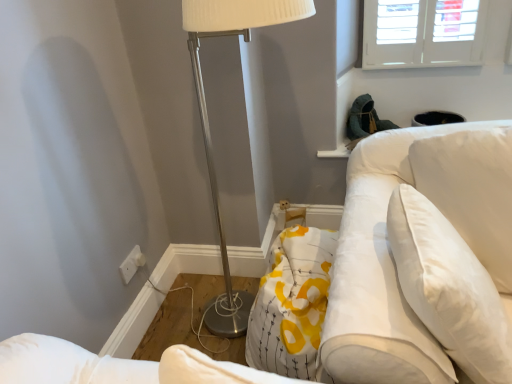
The width and height of the screenshot is (512, 384). Describe the element at coordinates (391, 254) in the screenshot. I see `white fabric swivel chair at right` at that location.

Describe the element at coordinates (132, 264) in the screenshot. I see `white plastic electric outlet at lower left` at that location.

What do you see at coordinates (208, 119) in the screenshot? The image size is (512, 384). I see `metallic silver floor lamp at center` at bounding box center [208, 119].

This screenshot has width=512, height=384. Describe the element at coordinates (449, 287) in the screenshot. I see `white soft pillow at upper right` at that location.

Measure the distance between white soft pillow at upper right and camera.

white soft pillow at upper right and camera are 33.03 inches apart from each other.

Locate an element on the screen. The height and width of the screenshot is (384, 512). white fabric swivel chair at right is located at coordinates (391, 254).

Which object is more forward, white fabric swivel chair at right or white soft pillow at upper right?

Positioned in front is white soft pillow at upper right.

Identify the location of swivel chair lying above the white soft pillow at upper right (from the image's perspective). (391, 254).

Can you tell me how much white fabric swivel chair at right and white soft pillow at upper right differ in facing direction?

There is a 25.9-degree angle between the facing directions of white fabric swivel chair at right and white soft pillow at upper right.

Considering the points (129, 277) and (223, 4), which point is in front, point (129, 277) or point (223, 4)?

The point (223, 4) is closer.

Considering the sizes of objects white plastic electric outlet at lower left and metallic silver floor lamp at center in the image provided, who is shorter, white plastic electric outlet at lower left or metallic silver floor lamp at center?

With less height is white plastic electric outlet at lower left.

Based on their positions, is white plastic electric outlet at lower left located to the left or right of metallic silver floor lamp at center?

Clearly, white plastic electric outlet at lower left is on the left of metallic silver floor lamp at center in the image.

From the image's perspective, would you say white plastic electric outlet at lower left is shown under metallic silver floor lamp at center?

Yes, from the image's perspective, white plastic electric outlet at lower left is below metallic silver floor lamp at center.

Can you confirm if white plastic electric outlet at lower left is shorter than white soft pillow at upper right?

Yes.

From a real-world perspective, is white plastic electric outlet at lower left under white soft pillow at upper right?

Yes.

Is point (129, 261) more distant than point (458, 278)?

Yes, point (129, 261) is farther from viewer.

Does white plastic electric outlet at lower left have a smaller size compared to white soft pillow at upper right?

Correct, white plastic electric outlet at lower left occupies less space than white soft pillow at upper right.

Does white plastic electric outlet at lower left have a lesser height compared to white fabric swivel chair at right?

Yes, white plastic electric outlet at lower left is shorter than white fabric swivel chair at right.

Is white plastic electric outlet at lower left far from white fabric swivel chair at right?

Yes.

Which is less distant, [130,263] or [400,351]?

The point [400,351] is in front.

Could you measure the distance between white plastic electric outlet at lower left and white fabric swivel chair at right?

white plastic electric outlet at lower left and white fabric swivel chair at right are 1.04 meters apart from each other.

Is white soft pillow at upper right positioned with its back to white plastic electric outlet at lower left?

No.

Is white soft pillow at upper right smaller than white plastic electric outlet at lower left?

No.

Considering the relative positions of white soft pillow at upper right and white plastic electric outlet at lower left in the image provided, is white soft pillow at upper right to the left of white plastic electric outlet at lower left from the viewer's perspective?

Incorrect, white soft pillow at upper right is not on the left side of white plastic electric outlet at lower left.

Which object is more forward, white soft pillow at upper right or white plastic electric outlet at lower left?

white soft pillow at upper right.

Are white soft pillow at upper right and metallic silver floor lamp at center beside each other?

white soft pillow at upper right is not next to metallic silver floor lamp at center, and they're not touching.

Is the position of white soft pillow at upper right less distant than that of metallic silver floor lamp at center?

Yes, white soft pillow at upper right is closer to the camera.

Considering the sizes of objects white soft pillow at upper right and metallic silver floor lamp at center in the image provided, who is smaller, white soft pillow at upper right or metallic silver floor lamp at center?

With smaller size is white soft pillow at upper right.

From a real-world perspective, is metallic silver floor lamp at center positioned above or below white fabric swivel chair at right?

From a real-world perspective, metallic silver floor lamp at center is physically above white fabric swivel chair at right.

From the picture: Could you tell me if metallic silver floor lamp at center is facing white fabric swivel chair at right?

No, metallic silver floor lamp at center is not turned towards white fabric swivel chair at right.

Identify the location of swivel chair to the right of metallic silver floor lamp at center. The image size is (512, 384). (391, 254).

Considering the sizes of objects metallic silver floor lamp at center and white fabric swivel chair at right in the image provided, who is taller, metallic silver floor lamp at center or white fabric swivel chair at right?

With more height is metallic silver floor lamp at center.

Where is `swivel chair above the white soft pillow at upper right (from the image's perspective)`? swivel chair above the white soft pillow at upper right (from the image's perspective) is located at coordinates (391, 254).

I want to click on electric outlet that appears behind the metallic silver floor lamp at center, so click(x=132, y=264).

From the image, which object appears to be farther from white plastic electric outlet at lower left, white fabric swivel chair at right or metallic silver floor lamp at center?

white fabric swivel chair at right.

From the picture: When comparing their distances from white fabric swivel chair at right, does white plastic electric outlet at lower left or white soft pillow at upper right seem closer?

The object closer to white fabric swivel chair at right is white soft pillow at upper right.

In the scene shown: Which object lies further to the anchor point white fabric swivel chair at right, white soft pillow at upper right or white plastic electric outlet at lower left?

white plastic electric outlet at lower left.

From the image, which object appears to be nearer to metallic silver floor lamp at center, white plastic electric outlet at lower left or white fabric swivel chair at right?

The object closer to metallic silver floor lamp at center is white plastic electric outlet at lower left.

Estimate the real-world distances between objects in this image. Which object is further from white plastic electric outlet at lower left, white soft pillow at upper right or metallic silver floor lamp at center?

white soft pillow at upper right.

Considering their positions, is white fabric swivel chair at right positioned further to white soft pillow at upper right than metallic silver floor lamp at center?

Among the two, metallic silver floor lamp at center is located further to white soft pillow at upper right.

Looking at the image, which one is located further to metallic silver floor lamp at center, white fabric swivel chair at right or white soft pillow at upper right?

The object further to metallic silver floor lamp at center is white soft pillow at upper right.

Estimate the real-world distances between objects in this image. Which object is further from white plastic electric outlet at lower left, white soft pillow at upper right or white fabric swivel chair at right?

Among the two, white soft pillow at upper right is located further to white plastic electric outlet at lower left.

You are a GUI agent. You are given a task and a screenshot of the screen. Output one action in this format:
    pyautogui.click(x=<x>, y=<y>)
    Task: Click on the pillow situated between metallic silver floor lamp at center and white fabric swivel chair at right from left to right
    This screenshot has height=384, width=512.
    Given the screenshot: What is the action you would take?
    pyautogui.click(x=449, y=287)

You are a GUI agent. You are given a task and a screenshot of the screen. Output one action in this format:
    pyautogui.click(x=<x>, y=<y>)
    Task: Click on the lamp positioned between white soft pillow at upper right and white plastic electric outlet at lower left from near to far
    
    Given the screenshot: What is the action you would take?
    pyautogui.click(x=208, y=119)

Locate an element on the screen. pillow between white plastic electric outlet at lower left and white fabric swivel chair at right is located at coordinates (449, 287).

Image resolution: width=512 pixels, height=384 pixels. What are the coordinates of `lamp located between white plastic electric outlet at lower left and white fabric swivel chair at right in the left-right direction` in the screenshot? It's located at (208, 119).